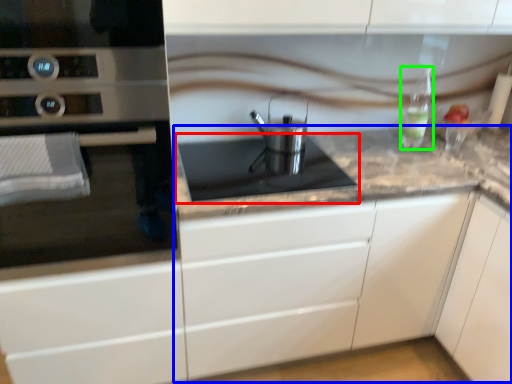
Question: Estimate the real-world distances between objects in this image. Which object is closer to gas stove (highlighted by a red box), counter (highlighted by a blue box) or bottle (highlighted by a green box)?

Choices:
 (A) counter
 (B) bottle

Answer: (A)